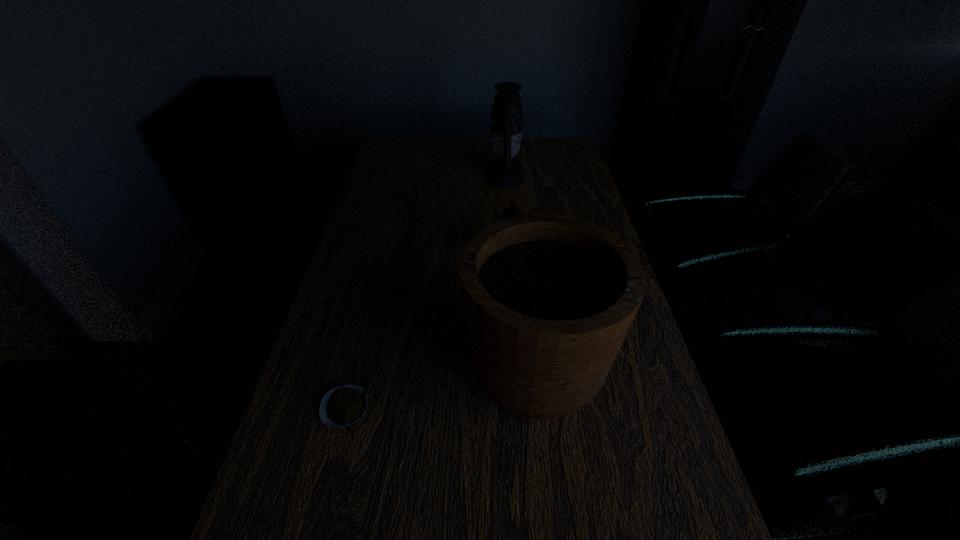
I want to click on empty space between the second farthest object and the leftmost object, so click(426, 332).

I want to click on vacant point located between the farthest object and the legume, so (x=425, y=293).

Locate an element on the screen. The width and height of the screenshot is (960, 540). free space between the leftmost object and the flowerpot is located at coordinates (441, 387).

You are a GUI agent. You are given a task and a screenshot of the screen. Output one action in this format:
    pyautogui.click(x=<x>, y=<y>)
    Task: Click on the object that can be found as the second closest to the oil lamp
    
    Given the screenshot: What is the action you would take?
    tap(548, 299)

Identify which object is the closest to the farthest object. Please provide its 2D coordinates. Your answer should be formatted as a tuple, i.e. [(x, y)], where the tuple contains the x and y coordinates of a point satisfying the conditions above.

[(512, 211)]

Where is `vacant space that satisfies the following two spatial constraints: 1. on the back side of the oil lamp; 2. on the left side of the shortest object`? This screenshot has height=540, width=960. vacant space that satisfies the following two spatial constraints: 1. on the back side of the oil lamp; 2. on the left side of the shortest object is located at coordinates (403, 178).

Locate an element on the screen. free space that satisfies the following two spatial constraints: 1. on the front side of the flowerpot; 2. on the right side of the oil lamp is located at coordinates (524, 367).

You are a GUI agent. You are given a task and a screenshot of the screen. Output one action in this format:
    pyautogui.click(x=<x>, y=<y>)
    Task: Click on the vacant point that satisfies the following two spatial constraints: 1. on the back side of the farthest object; 2. on the left side of the thermos bottle
    
    Given the screenshot: What is the action you would take?
    [x=503, y=178]

Locate an element on the screen. Image resolution: width=960 pixels, height=540 pixels. blank area in the image that satisfies the following two spatial constraints: 1. on the back side of the oil lamp; 2. on the right side of the leftmost object is located at coordinates (403, 178).